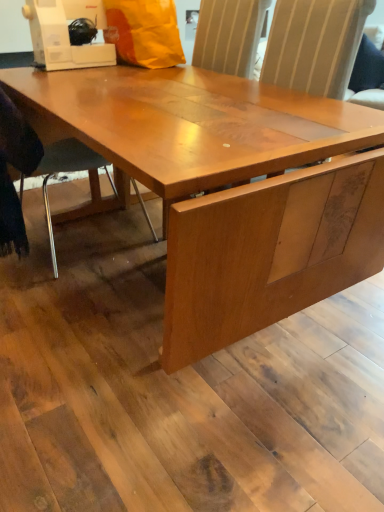
Question: Can we say orange matte paper bag at upper center lies outside metallic gray chair at lower left?

Choices:
 (A) no
 (B) yes

Answer: (B)

Question: Can you confirm if orange matte paper bag at upper center is taller than metallic gray chair at lower left?

Choices:
 (A) yes
 (B) no

Answer: (B)

Question: From the image's perspective, would you say orange matte paper bag at upper center is shown under metallic gray chair at lower left?

Choices:
 (A) yes
 (B) no

Answer: (B)

Question: Is the depth of orange matte paper bag at upper center less than that of metallic gray chair at lower left?

Choices:
 (A) no
 (B) yes

Answer: (A)

Question: Is orange matte paper bag at upper center shorter than metallic gray chair at lower left?

Choices:
 (A) yes
 (B) no

Answer: (A)

Question: From a real-world perspective, relative to orange matte paper bag at upper center, is white plastic sewing machine at upper left vertically above or below?

Choices:
 (A) above
 (B) below

Answer: (A)

Question: Is white plastic sewing machine at upper left bigger or smaller than orange matte paper bag at upper center?

Choices:
 (A) big
 (B) small

Answer: (B)

Question: Considering their positions, is white plastic sewing machine at upper left located in front of or behind orange matte paper bag at upper center?

Choices:
 (A) behind
 (B) front

Answer: (B)

Question: From the image's perspective, relative to orange matte paper bag at upper center, is white plastic sewing machine at upper left above or below?

Choices:
 (A) above
 (B) below

Answer: (B)

Question: Is metallic gray chair at lower left inside or outside of orange matte paper bag at upper center?

Choices:
 (A) outside
 (B) inside

Answer: (A)

Question: Visually, is metallic gray chair at lower left positioned to the left or to the right of orange matte paper bag at upper center?

Choices:
 (A) left
 (B) right

Answer: (A)

Question: Considering the positions of metallic gray chair at lower left and orange matte paper bag at upper center in the image, is metallic gray chair at lower left taller or shorter than orange matte paper bag at upper center?

Choices:
 (A) short
 (B) tall

Answer: (B)

Question: From the image's perspective, is metallic gray chair at lower left positioned above or below orange matte paper bag at upper center?

Choices:
 (A) above
 (B) below

Answer: (B)

Question: From the image's perspective, is orange matte paper bag at upper center above or below white plastic sewing machine at upper left?

Choices:
 (A) below
 (B) above

Answer: (B)

Question: Based on their sizes in the image, would you say orange matte paper bag at upper center is bigger or smaller than white plastic sewing machine at upper left?

Choices:
 (A) big
 (B) small

Answer: (A)